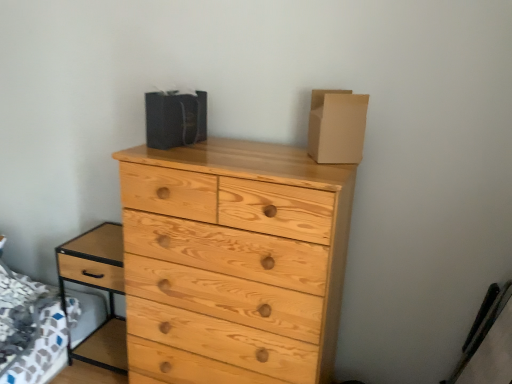
Identify the location of vacant area that is in front of matte black bag at upper center, the second cardboard box positioned from the right. This screenshot has width=512, height=384. (184, 148).